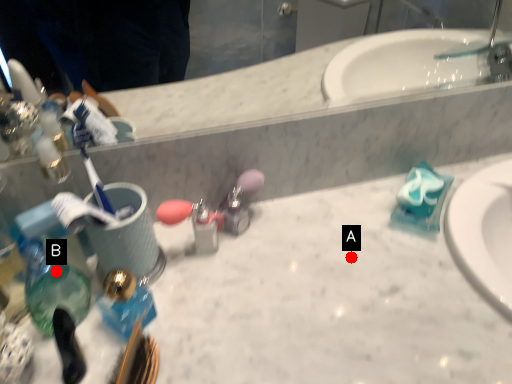
Question: Two points are circled on the image, labeled by A and B beside each circle. Which point is farther from the camera taking this photo?

Choices:
 (A) A is further
 (B) B is further

Answer: (A)